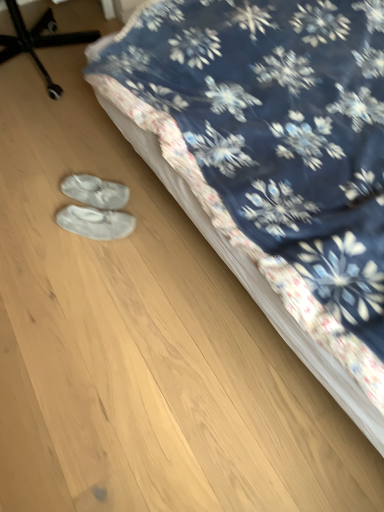
In order to click on vacant region below white fabric shoe covers at lower left, which ranks as the first footwear in top-to-bottom order (from a real-world perspective) in this screenshot , I will do `click(94, 201)`.